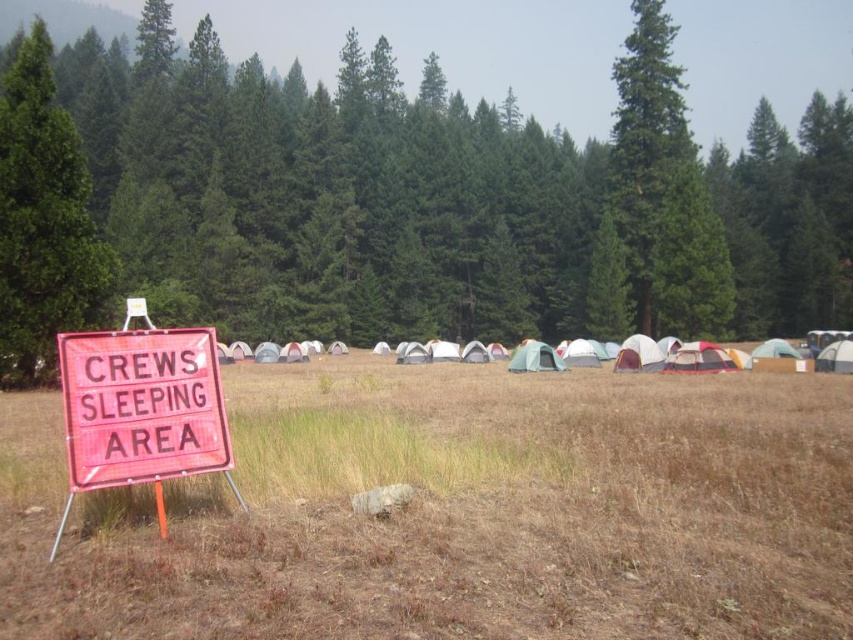
Between point (44, 560) and point (519, 356), which one is positioned in front?

Point (44, 560) is in front.

Can you confirm if brown dry grass at center is shorter than white fabric tent at center?

Indeed, brown dry grass at center has a lesser height compared to white fabric tent at center.

Between point (436, 480) and point (554, 360), which one is positioned behind?

The point (554, 360) is more distant.

At what (x,y) coordinates should I click in order to perform the action: click on brown dry grass at center. Please return your answer as a coordinate pair (x, y). The height and width of the screenshot is (640, 853). Looking at the image, I should click on (457, 513).

Can you confirm if green matte tree at left is smaller than pink plastic sign at left?

Incorrect, green matte tree at left is not smaller in size than pink plastic sign at left.

Image resolution: width=853 pixels, height=640 pixels. I want to click on green matte tree at left, so click(44, 218).

Is green matte tree at center to the right of pink plastic sign at left from the viewer's perspective?

Indeed, green matte tree at center is positioned on the right side of pink plastic sign at left.

Can you confirm if green matte tree at center is taller than pink plastic sign at left?

Yes, green matte tree at center is taller than pink plastic sign at left.

This screenshot has width=853, height=640. In order to click on green matte tree at center in this screenshot , I will do `click(398, 202)`.